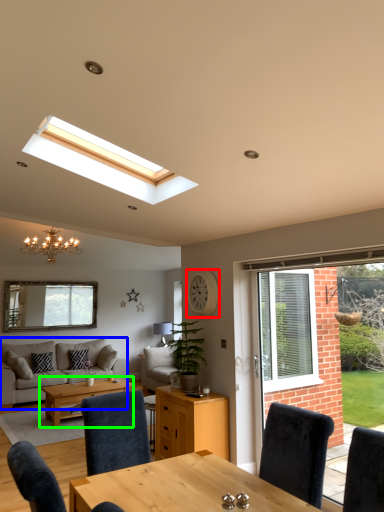
Question: Estimate the real-world distances between objects in this image. Which object is farther from clock (highlighted by a red box), studio couch (highlighted by a blue box) or coffee table (highlighted by a green box)?

Choices:
 (A) studio couch
 (B) coffee table

Answer: (A)